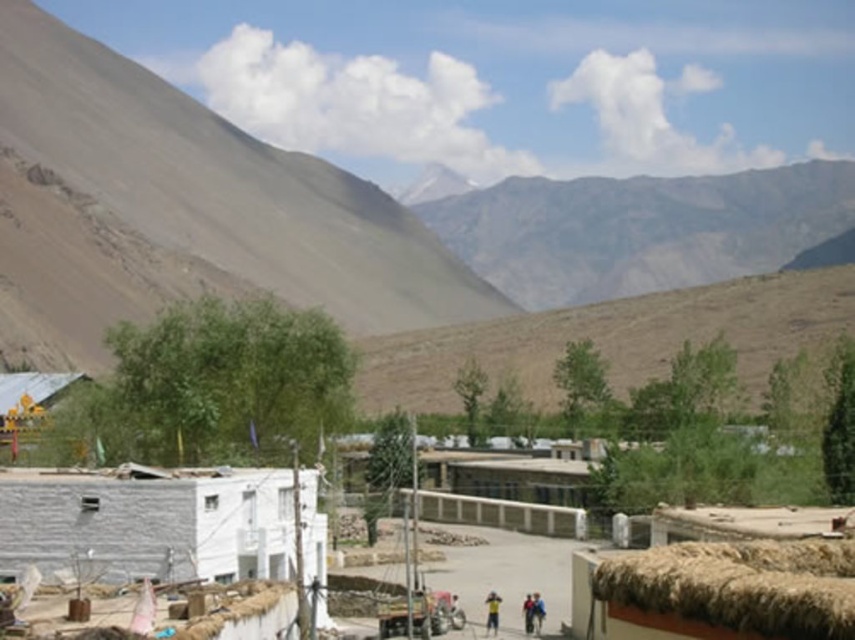
The width and height of the screenshot is (855, 640). In order to click on brown/dry soil mountain at upper left in this screenshot , I will do `click(375, 241)`.

Image resolution: width=855 pixels, height=640 pixels. What do you see at coordinates (375, 241) in the screenshot?
I see `brown/dry soil mountain at upper left` at bounding box center [375, 241].

Is point (634, 362) positioned behind point (532, 600)?

Yes, it is.

The height and width of the screenshot is (640, 855). I want to click on brown/dry soil mountain at upper left, so click(x=375, y=241).

Does white concrete hut at lower left have a greater width compared to blue fabric person at center?

Indeed, white concrete hut at lower left has a greater width compared to blue fabric person at center.

In the scene shown: Is white concrete hut at lower left smaller than blue fabric person at center?

Actually, white concrete hut at lower left might be larger than blue fabric person at center.

At what (x,y) coordinates should I click in order to perform the action: click on white concrete hut at lower left. Please return your answer as a coordinate pair (x, y). Looking at the image, I should click on (148, 524).

Is point (808, 196) behind point (535, 592)?

Yes.

Is gray rocky mountain at upper center to the right of light brown fabric at center from the viewer's perspective?

Indeed, gray rocky mountain at upper center is positioned on the right side of light brown fabric at center.

Measure the distance between point (500, 218) and camera.

Point (500, 218) and camera are 402.93 meters apart.

Image resolution: width=855 pixels, height=640 pixels. What are the coordinates of `gray rocky mountain at upper center` in the screenshot? It's located at (640, 228).